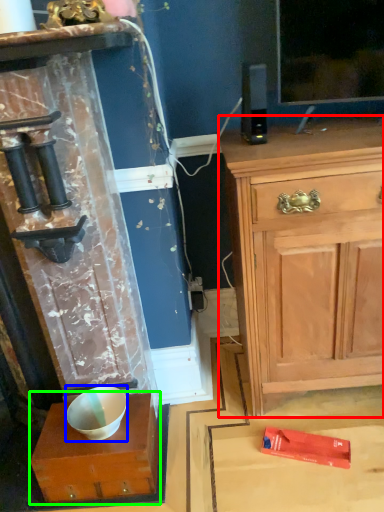
Question: Which object is the closest to the chest of drawers (highlighted by a red box)? Choose among these: bowl (highlighted by a blue box) or cabinetry (highlighted by a green box).

Choices:
 (A) bowl
 (B) cabinetry

Answer: (B)